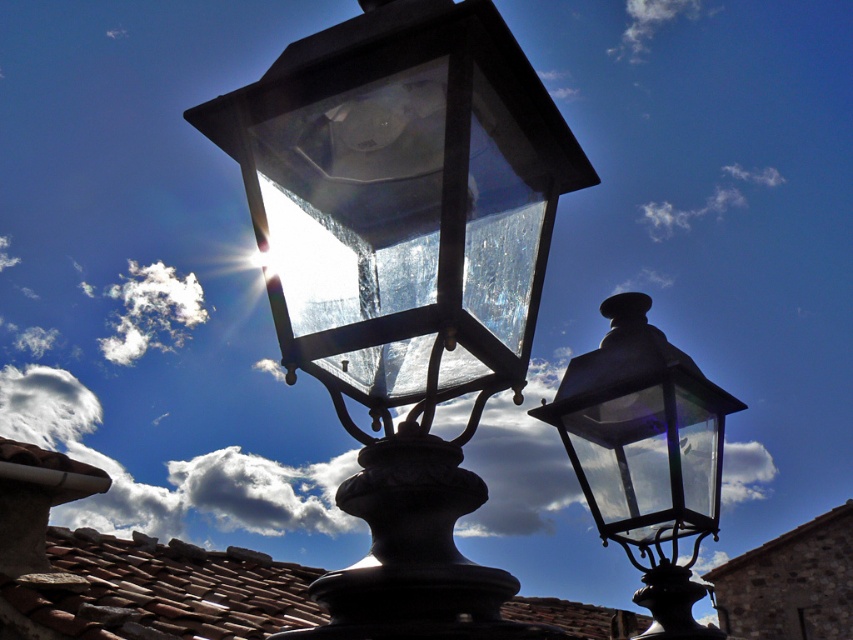
You are a photographer setting up a tripod to capture both the matte glass lantern at center and the matte glass lamp at right in the same frame. Given that your camera has a focal length of 50mm, which requires a minimum distance of 1.5 meters between objects to capture them clearly, can you include both in the shot without moving the tripod?

The matte glass lantern at center is 1.26 meters from the matte glass lamp at right, which is less than the required 1.5 meters. Therefore, you cannot include both in the shot without moving the tripod.